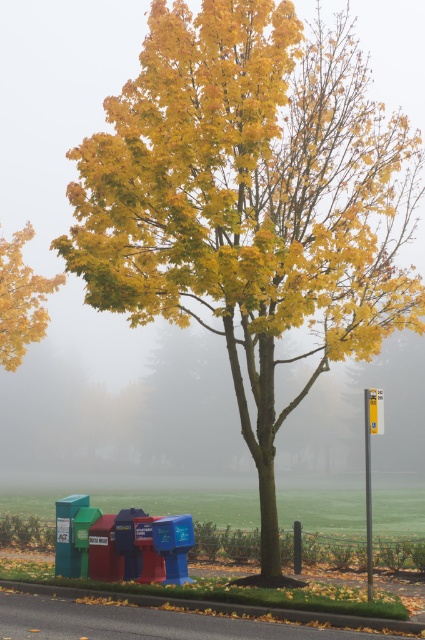
Question: Can you confirm if yellow matte tree at upper left is thinner than green rubber curb at lower center?

Choices:
 (A) yes
 (B) no

Answer: (B)

Question: Which object appears farthest from the camera in this image?

Choices:
 (A) green rubber curb at lower center
 (B) yellow matte tree at upper left

Answer: (B)

Question: Is yellow matte tree at upper left to the right of green rubber curb at lower center from the viewer's perspective?

Choices:
 (A) yes
 (B) no

Answer: (B)

Question: Is yellow matte tree at upper left smaller than green rubber curb at lower center?

Choices:
 (A) no
 (B) yes

Answer: (A)